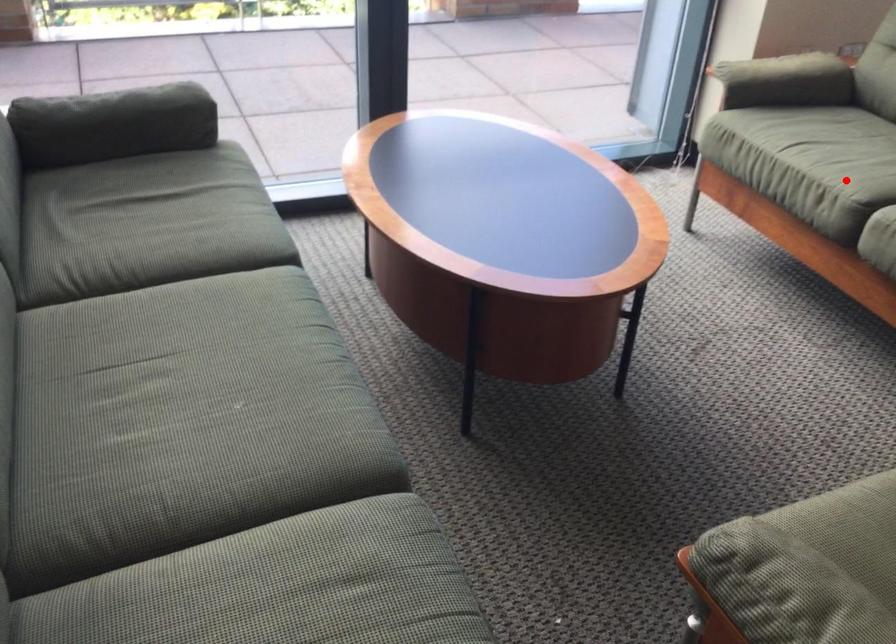
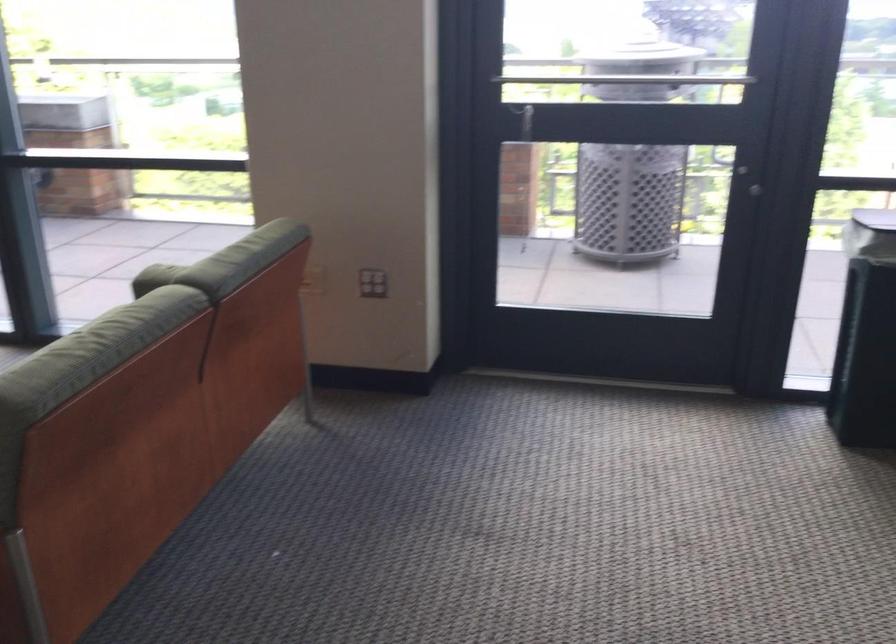
Question: I am providing you with two images of the same scene from different viewpoints. A red point is marked on the first image. Is the red point's position out of view in image 2?

Choices:
 (A) Yes
 (B) No

Answer: (A)